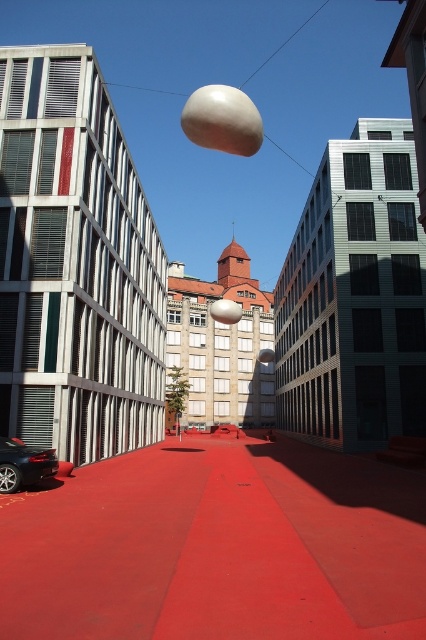
Question: Which object appears farthest from the camera in this image?

Choices:
 (A) shiny black car at lower left
 (B) red rubber plaza at center

Answer: (A)

Question: Among these points, which one is nearest to the camera?

Choices:
 (A) (8, 442)
 (B) (193, 595)

Answer: (B)

Question: Is red rubber plaza at center to the left of shiny black car at lower left from the viewer's perspective?

Choices:
 (A) yes
 (B) no

Answer: (B)

Question: Can you confirm if red rubber plaza at center is positioned to the right of shiny black car at lower left?

Choices:
 (A) no
 (B) yes

Answer: (B)

Question: Is red rubber plaza at center above shiny black car at lower left?

Choices:
 (A) yes
 (B) no

Answer: (B)

Question: Which of the following is the farthest from the observer?

Choices:
 (A) red rubber plaza at center
 (B) shiny black car at lower left

Answer: (B)